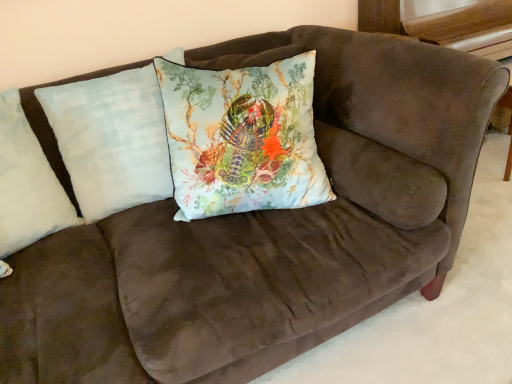
Question: Looking at the image, does light blue fabric pillow at center, the first pillow viewed from the right, seem bigger or smaller compared to light blue fabric pillow at center, arranged as the 2th pillow when viewed from the right?

Choices:
 (A) big
 (B) small

Answer: (A)

Question: Is light blue fabric pillow at center, the first pillow viewed from the right, to the left or to the right of light blue fabric pillow at center, arranged as the 2th pillow when viewed from the right, in the image?

Choices:
 (A) right
 (B) left

Answer: (A)

Question: Which is farther from the light blue fabric pillow at center, arranged as the 2th pillow when viewed from the right?

Choices:
 (A) light blue fabric pillow at center, the third pillow in the left-to-right sequence
 (B) white soft pillow at left, the first pillow viewed from the left

Answer: (A)

Question: Based on their relative distances, which object is nearer to the light blue fabric pillow at center, arranged as the 2th pillow when viewed from the right?

Choices:
 (A) white soft pillow at left, the first pillow viewed from the left
 (B) light blue fabric pillow at center, the first pillow viewed from the right

Answer: (A)